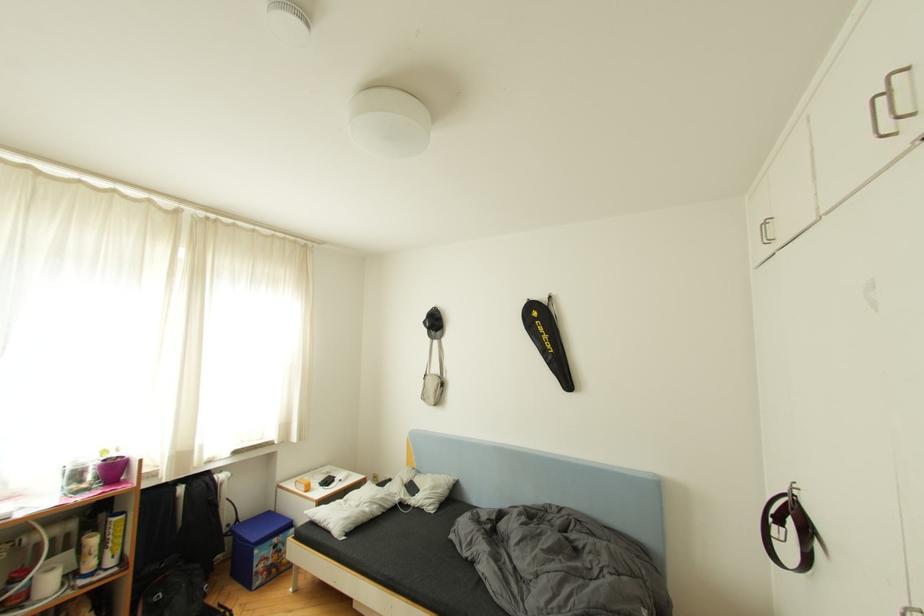
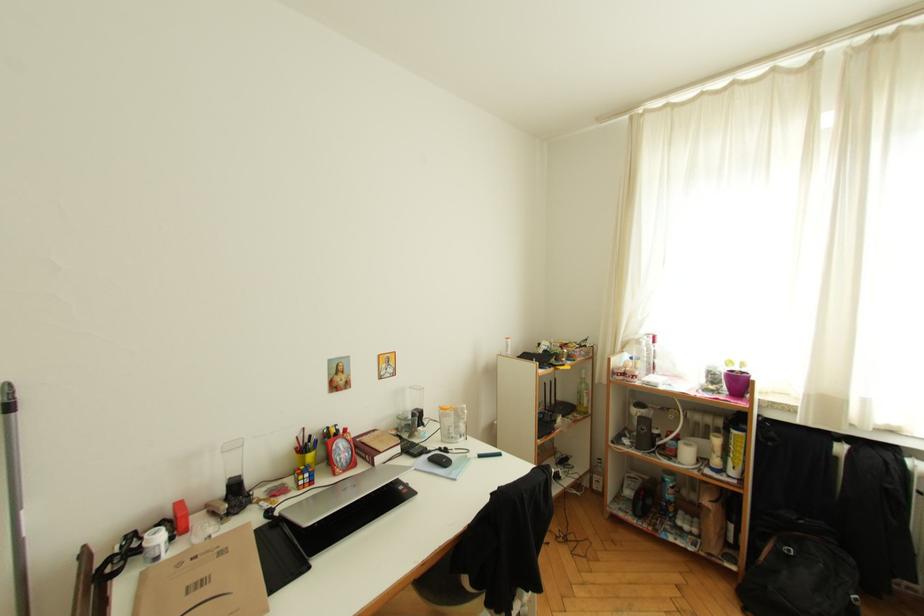
Question: The images are taken continuously from a first-person perspective. In which direction is your viewpoint rotating?

Choices:
 (A) Left
 (B) Right
 (C) Up
 (D) Down

Answer: (A)